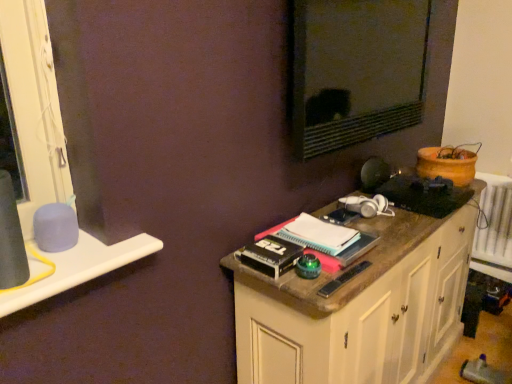
Question: Is matte black mirror at upper center in front of or behind wooden cabinet at right in the image?

Choices:
 (A) behind
 (B) front

Answer: (A)

Question: From the image's perspective, is matte black mirror at upper center positioned above or below wooden cabinet at right?

Choices:
 (A) below
 (B) above

Answer: (B)

Question: Based on their relative distances, which object is farther from the matte black mirror at upper center?

Choices:
 (A) white plastic window sill at left
 (B) wooden cabinet at right

Answer: (A)

Question: Considering the real-world distances, which object is closest to the wooden cabinet at right?

Choices:
 (A) matte black mirror at upper center
 (B) white plastic window sill at left

Answer: (A)